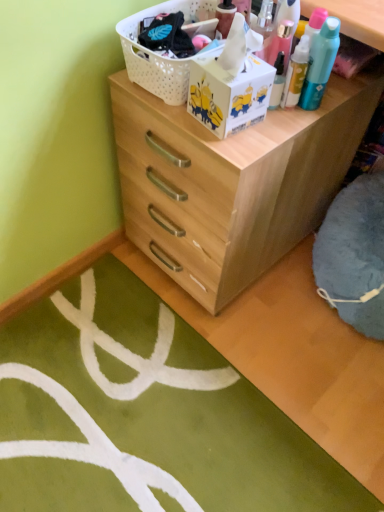
Question: Is natural wood chest of drawers at center situated inside white plastic basket at upper center or outside?

Choices:
 (A) inside
 (B) outside

Answer: (B)

Question: Considering the positions of natural wood chest of drawers at center and white plastic basket at upper center in the image, is natural wood chest of drawers at center taller or shorter than white plastic basket at upper center?

Choices:
 (A) tall
 (B) short

Answer: (A)

Question: Does point (203, 260) appear closer or farther from the camera than point (135, 81)?

Choices:
 (A) farther
 (B) closer

Answer: (A)

Question: From a real-world perspective, is white plastic basket at upper center physically located above or below natural wood chest of drawers at center?

Choices:
 (A) below
 (B) above

Answer: (B)

Question: In the image, is white plastic basket at upper center on the left side or the right side of natural wood chest of drawers at center?

Choices:
 (A) right
 (B) left

Answer: (B)

Question: In terms of height, does white plastic basket at upper center look taller or shorter compared to natural wood chest of drawers at center?

Choices:
 (A) tall
 (B) short

Answer: (B)

Question: Is white plastic basket at upper center inside or outside of natural wood chest of drawers at center?

Choices:
 (A) outside
 (B) inside

Answer: (A)